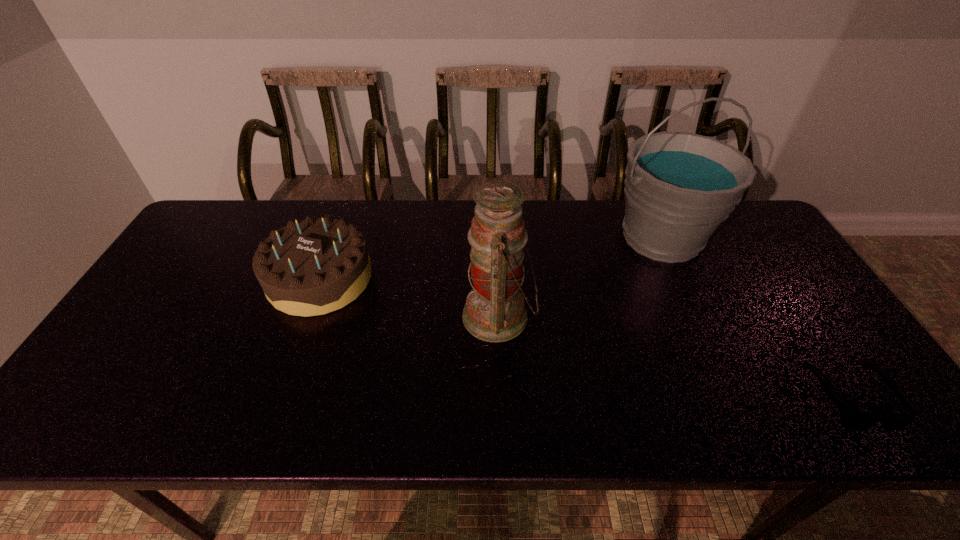
This screenshot has width=960, height=540. Find the location of `vacant region that satisfies the following two spatial constraints: 1. on the front-facing side of the birthday cake; 2. on the left side of the third object from right to left`. vacant region that satisfies the following two spatial constraints: 1. on the front-facing side of the birthday cake; 2. on the left side of the third object from right to left is located at coordinates (306, 316).

Find the location of a particular element. vacant space that satisfies the following two spatial constraints: 1. on the front-facing side of the oil lamp; 2. on the right side of the leftmost object is located at coordinates (306, 316).